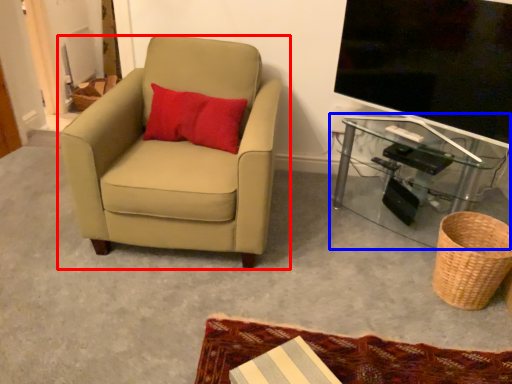
Question: Among these objects, which one is farthest to the camera, chair (highlighted by a red box) or table (highlighted by a blue box)?

Choices:
 (A) chair
 (B) table

Answer: (B)